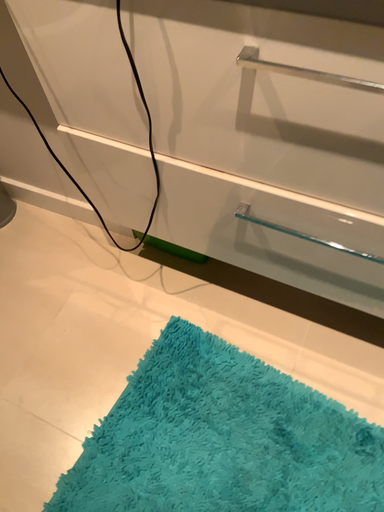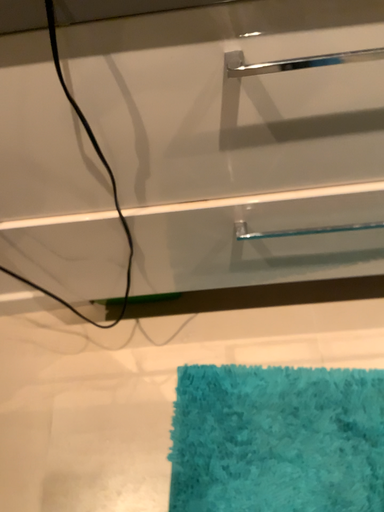
Question: Which way did the camera rotate in the video?

Choices:
 (A) rotated right
 (B) rotated left

Answer: (A)